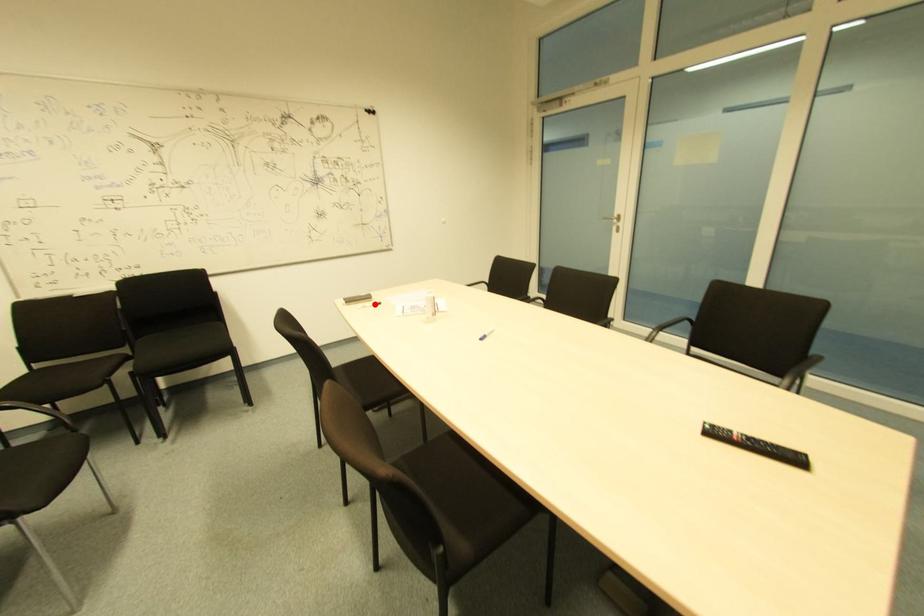
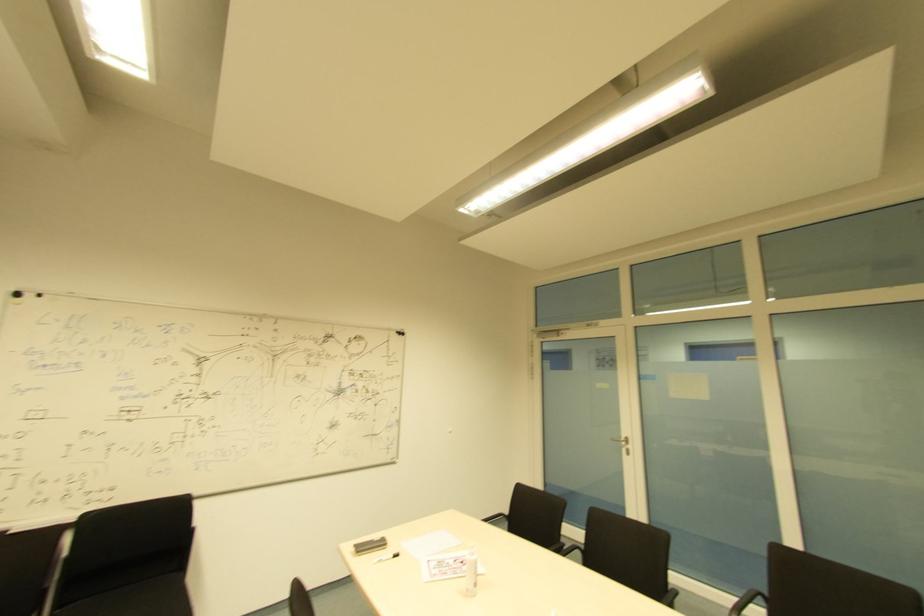
Locate, in the second image, the point that corresponds to the highlighted location in the first image.

(394, 554)